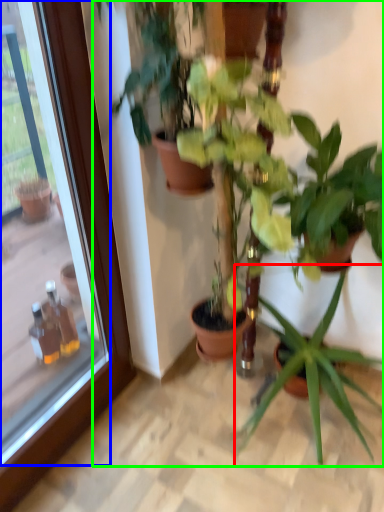
Question: Considering the real-world distances, which object is closest to houseplant (highlighted by a red box)? glass door (highlighted by a blue box) or houseplant (highlighted by a green box).

Choices:
 (A) glass door
 (B) houseplant

Answer: (B)